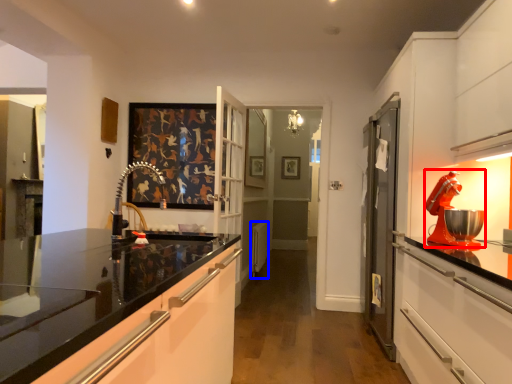
Question: Which point is further to the camera, home appliance (highlighted by a red box) or appliance (highlighted by a blue box)?

Choices:
 (A) home appliance
 (B) appliance

Answer: (B)